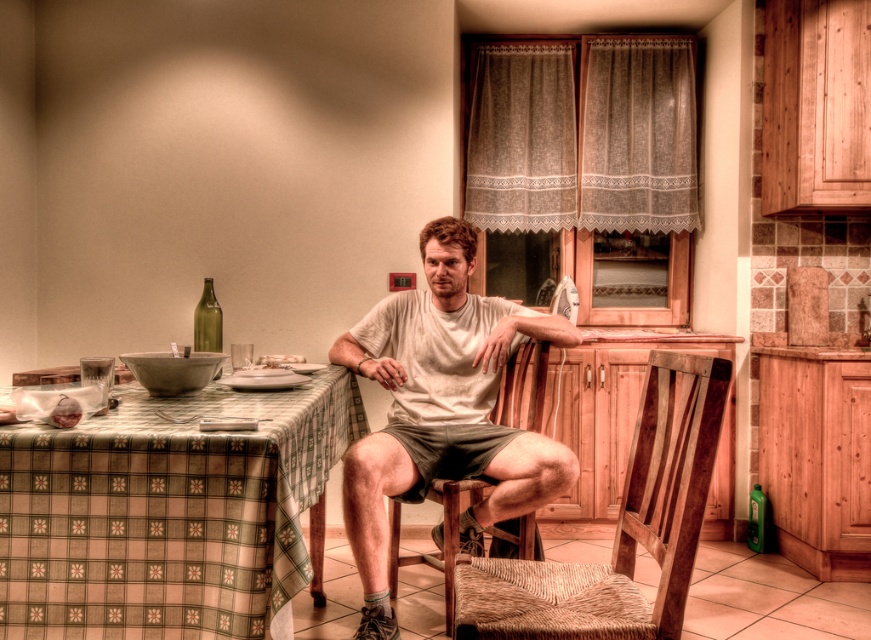
Question: Among these objects, which one is nearest to the camera?

Choices:
 (A) green checkered tablecloth at lower left
 (B) matte white t-shirt at center
 (C) green glass bottle at table left
 (D) woven wood chair at center

Answer: (D)

Question: Which object is positioned closest to the matte white t-shirt at center?

Choices:
 (A) green checkered tablecloth at lower left
 (B) woven wood chair at center
 (C) green glass bottle at table left

Answer: (A)

Question: Can you confirm if green checkered tablecloth at lower left is wider than matte white t-shirt at center?

Choices:
 (A) no
 (B) yes

Answer: (A)

Question: Among these points, which one is nearest to the camera?

Choices:
 (A) (388, 432)
 (B) (255, 449)

Answer: (B)

Question: Can you confirm if matte white t-shirt at center is positioned above green glass bottle at table left?

Choices:
 (A) no
 (B) yes

Answer: (A)

Question: Does matte white t-shirt at center appear under woven wood chair at center?

Choices:
 (A) yes
 (B) no

Answer: (B)